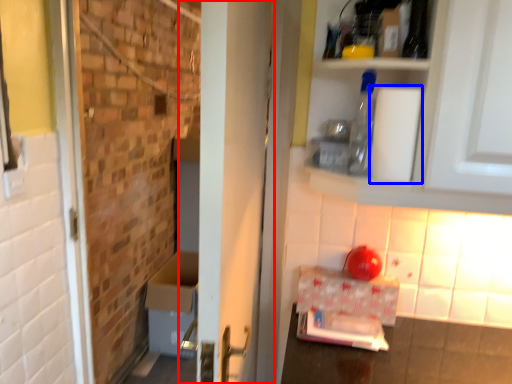
Question: Which point is further to the camera, door (highlighted by a red box) or toilet paper (highlighted by a blue box)?

Choices:
 (A) door
 (B) toilet paper

Answer: (B)